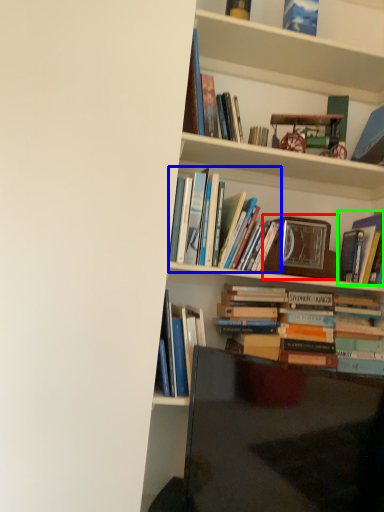
Question: Which object is positioned farthest from picture frame (highlighted by a red box)? Select from book (highlighted by a blue box) and book (highlighted by a green box).

Choices:
 (A) book
 (B) book

Answer: (A)